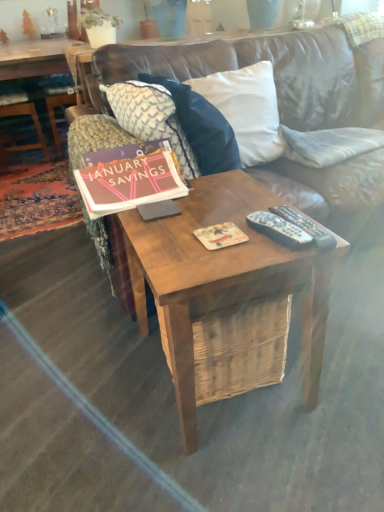
You are a GUI agent. You are given a task and a screenshot of the screen. Output one action in this format:
    pyautogui.click(x=<x>, y=<y>)
    Task: Click on the vacant space behind black plastic remote controls at center, arranged as the 1th remote control when viewed from the right
    
    Given the screenshot: What is the action you would take?
    pyautogui.click(x=256, y=199)